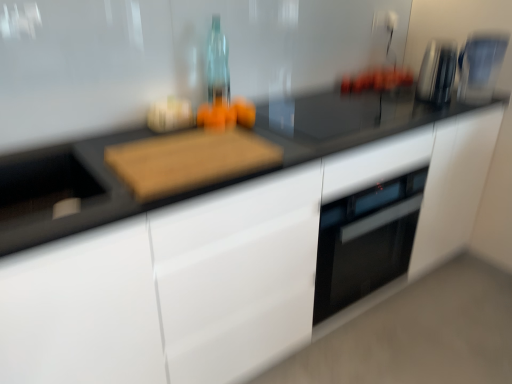
I want to click on satin silver toaster at upper right, so click(437, 72).

Image resolution: width=512 pixels, height=384 pixels. What do you see at coordinates (480, 66) in the screenshot?
I see `sleek metallic coffee machine at upper right` at bounding box center [480, 66].

This screenshot has width=512, height=384. Identify the location of satin silver toaster at upper right. (437, 72).

Based on the photo, is satin silver toaster at upper right behind sleek metallic coffee machine at upper right?

No.

Does satin silver toaster at upper right have a lesser height compared to sleek metallic coffee machine at upper right?

Yes.

From a real-world perspective, between satin silver toaster at upper right and sleek metallic coffee machine at upper right, who is vertically lower?

satin silver toaster at upper right, from a real-world perspective.

Is satin silver toaster at upper right not close to sleek metallic coffee machine at upper right?

They are positioned close to each other.

Is wooden cutting board at center looking in the opposite direction of sleek metallic coffee machine at upper right?

No, wooden cutting board at center is not facing the opposite direction of sleek metallic coffee machine at upper right.

Do you think wooden cutting board at center is within sleek metallic coffee machine at upper right, or outside of it?

wooden cutting board at center lies outside sleek metallic coffee machine at upper right.

Is wooden cutting board at center bigger than sleek metallic coffee machine at upper right?

No, wooden cutting board at center is not bigger than sleek metallic coffee machine at upper right.

Is wooden cutting board at center not near sleek metallic coffee machine at upper right?

wooden cutting board at center is far away from sleek metallic coffee machine at upper right.

Does orange matte oranges at center lie behind satin silver toaster at upper right?

No, orange matte oranges at center is closer to the viewer.

Looking at the image, does orange matte oranges at center seem bigger or smaller compared to satin silver toaster at upper right?

orange matte oranges at center is smaller than satin silver toaster at upper right.

Considering the relative positions of orange matte oranges at center and satin silver toaster at upper right in the image provided, is orange matte oranges at center to the left of satin silver toaster at upper right from the viewer's perspective?

Yes.

Is orange matte oranges at center looking in the opposite direction of satin silver toaster at upper right?

No, orange matte oranges at center is not facing away from satin silver toaster at upper right.

This screenshot has height=384, width=512. Find the location of `appliance that is behind the orange matte oranges at center`. appliance that is behind the orange matte oranges at center is located at coordinates coord(437,72).

Considering the relative positions of satin silver toaster at upper right and orange matte oranges at center in the image provided, is satin silver toaster at upper right behind orange matte oranges at center?

That is True.

From the image's perspective, does satin silver toaster at upper right appear lower than orange matte oranges at center?

No, from the image's perspective, satin silver toaster at upper right is not below orange matte oranges at center.

From a real-world perspective, relative to orange matte oranges at center, is satin silver toaster at upper right vertically above or below?

satin silver toaster at upper right is situated higher than orange matte oranges at center in the real world.

Where is `food lying on the left of sleek metallic coffee machine at upper right`? This screenshot has height=384, width=512. food lying on the left of sleek metallic coffee machine at upper right is located at coordinates (226, 114).

Is orange matte oranges at center positioned far away from sleek metallic coffee machine at upper right?

Absolutely, orange matte oranges at center is distant from sleek metallic coffee machine at upper right.

Considering the sizes of orange matte oranges at center and sleek metallic coffee machine at upper right in the image, is orange matte oranges at center wider or thinner than sleek metallic coffee machine at upper right?

In the image, orange matte oranges at center appears to be more narrow than sleek metallic coffee machine at upper right.

Is orange matte oranges at center facing away from sleek metallic coffee machine at upper right?

orange matte oranges at center is not turned away from sleek metallic coffee machine at upper right.

From a real-world perspective, is sleek metallic coffee machine at upper right on satin silver toaster at upper right?

Yes.

Between sleek metallic coffee machine at upper right and satin silver toaster at upper right, which one has smaller size?

satin silver toaster at upper right.

Considering the positions of objects sleek metallic coffee machine at upper right and satin silver toaster at upper right in the image provided, who is more to the left, sleek metallic coffee machine at upper right or satin silver toaster at upper right?

satin silver toaster at upper right.

Is sleek metallic coffee machine at upper right inside the boundaries of satin silver toaster at upper right, or outside?

sleek metallic coffee machine at upper right is not inside satin silver toaster at upper right, it's outside.

From the image's perspective, is orange matte oranges at center on wooden cutting board at center?

Yes, from the image's perspective, orange matte oranges at center is on top of wooden cutting board at center.

The width and height of the screenshot is (512, 384). In order to click on food lying above the wooden cutting board at center (from the image's perspective) in this screenshot , I will do (226, 114).

Which is nearer, (x=234, y=116) or (x=125, y=170)?

Point (x=234, y=116) is farther from the camera than point (x=125, y=170).

Locate an element on the screen. The width and height of the screenshot is (512, 384). coffee machine that appears above the satin silver toaster at upper right (from the image's perspective) is located at coordinates [480, 66].

Where is `cutting board below the sleek metallic coffee machine at upper right (from the image's perspective)`? cutting board below the sleek metallic coffee machine at upper right (from the image's perspective) is located at coordinates (189, 160).

Considering their positions, is satin silver toaster at upper right positioned further to orange matte oranges at center than sleek metallic coffee machine at upper right?

The object further to orange matte oranges at center is sleek metallic coffee machine at upper right.

When comparing their distances from satin silver toaster at upper right, does sleek metallic coffee machine at upper right or wooden cutting board at center seem closer?

sleek metallic coffee machine at upper right.

Which object lies further to the anchor point wooden cutting board at center, orange matte oranges at center or sleek metallic coffee machine at upper right?

sleek metallic coffee machine at upper right.

Estimate the real-world distances between objects in this image. Which object is closer to sleek metallic coffee machine at upper right, wooden cutting board at center or orange matte oranges at center?

orange matte oranges at center is positioned closer to the anchor sleek metallic coffee machine at upper right.

When comparing their distances from wooden cutting board at center, does orange matte oranges at center or satin silver toaster at upper right seem further?

Among the two, satin silver toaster at upper right is located further to wooden cutting board at center.

Considering their positions, is sleek metallic coffee machine at upper right positioned closer to orange matte oranges at center than satin silver toaster at upper right?

satin silver toaster at upper right is closer to orange matte oranges at center.

Based on their spatial positions, is satin silver toaster at upper right or orange matte oranges at center further from wooden cutting board at center?

The object further to wooden cutting board at center is satin silver toaster at upper right.

When comparing their distances from satin silver toaster at upper right, does wooden cutting board at center or orange matte oranges at center seem closer?

Based on the image, orange matte oranges at center appears to be nearer to satin silver toaster at upper right.

At what (x,y) coordinates should I click in order to perform the action: click on food between wooden cutting board at center and satin silver toaster at upper right in the horizontal direction. Please return your answer as a coordinate pair (x, y). The height and width of the screenshot is (384, 512). Looking at the image, I should click on (226, 114).

Identify the location of food between wooden cutting board at center and sleek metallic coffee machine at upper right from left to right. (226, 114).

Identify the location of appliance located between orange matte oranges at center and sleek metallic coffee machine at upper right in the left-right direction. pos(437,72).

Where is `appliance located between wooden cutting board at center and sleek metallic coffee machine at upper right in the left-right direction`? appliance located between wooden cutting board at center and sleek metallic coffee machine at upper right in the left-right direction is located at coordinates (437, 72).